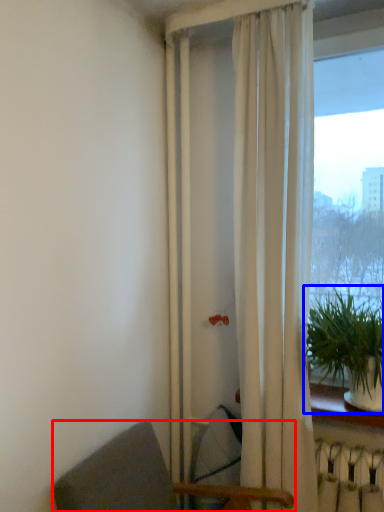
Question: Which object appears closest to the camera in this image, chair (highlighted by a red box) or houseplant (highlighted by a blue box)?

Choices:
 (A) chair
 (B) houseplant

Answer: (A)